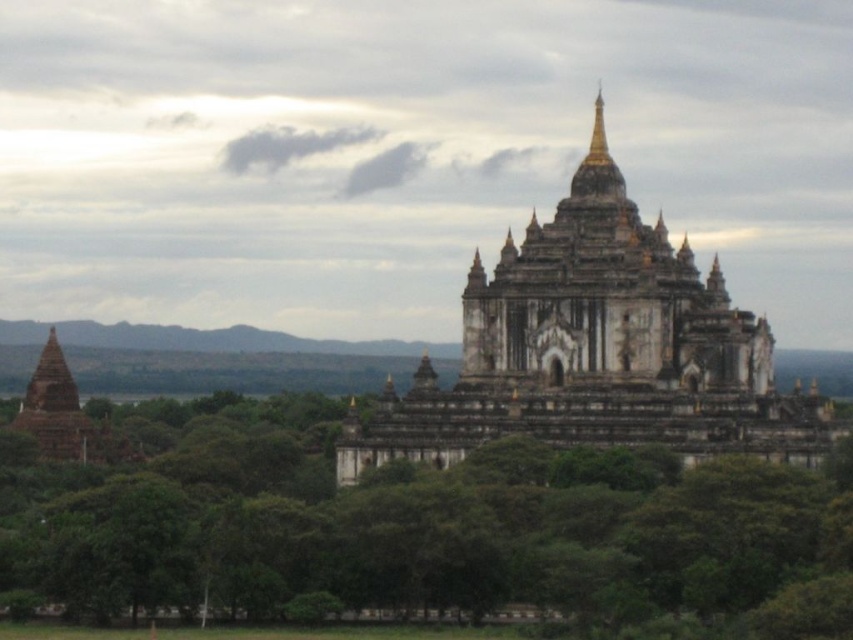
Is white stone pagoda at center to the right of matte brown stupa at left from the viewer's perspective?

Yes, white stone pagoda at center is to the right of matte brown stupa at left.

Is white stone pagoda at center wider than matte brown stupa at left?

Yes.

This screenshot has height=640, width=853. I want to click on white stone pagoda at center, so click(596, 349).

Does green leafy trees at center have a greater height compared to matte brown stupa at left?

Correct, green leafy trees at center is much taller as matte brown stupa at left.

What do you see at coordinates (405, 529) in the screenshot?
I see `green leafy trees at center` at bounding box center [405, 529].

The height and width of the screenshot is (640, 853). Identify the location of green leafy trees at center. (405, 529).

Is green leafy trees at center taller than white stone pagoda at center?

Incorrect, green leafy trees at center's height is not larger of white stone pagoda at center's.

Locate an element on the screen. Image resolution: width=853 pixels, height=640 pixels. green leafy trees at center is located at coordinates (405, 529).

This screenshot has height=640, width=853. In order to click on green leafy trees at center in this screenshot , I will do `click(405, 529)`.